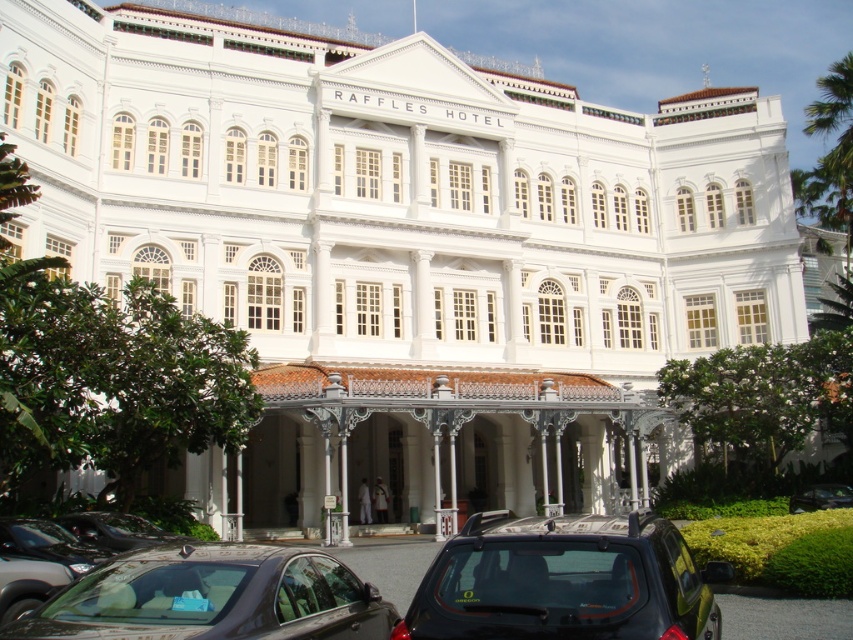
You are a tour guide giving a walking tour of Raffles Hotel. You notice two cars in the courtyard. Which car is taller, the black matte car at lower center or the shiny black car at lower left?

The black matte car at lower center is taller than the shiny black car at lower left.

You are a tour guide leading visitors to the entrance of Raffles Hotel. You see the black matte car at lower center and the shiny black car at lower left. Which car is closer to the hotel entrance?

The black matte car at lower center is closer to the hotel entrance because it is in front of the shiny black car at lower left, meaning it is positioned nearer to the entrance.